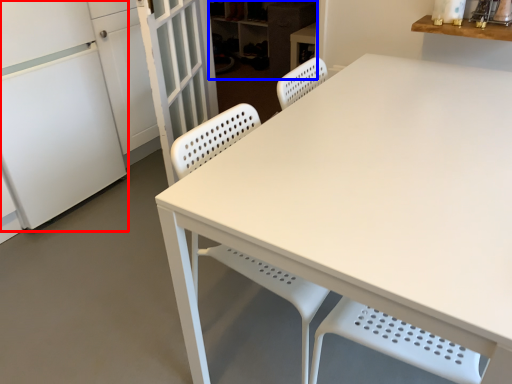
Question: Which object appears closest to the camera in this image, fridge (highlighted by a red box) or cabinetry (highlighted by a blue box)?

Choices:
 (A) fridge
 (B) cabinetry

Answer: (A)